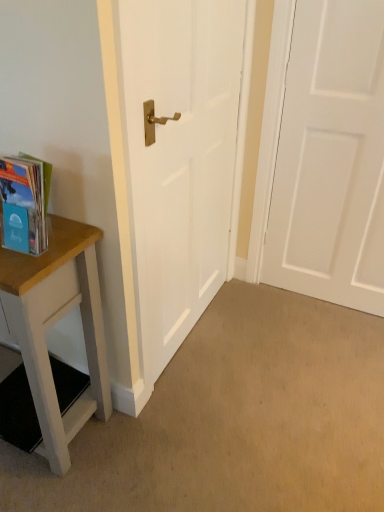
Locate an element on the screen. This screenshot has width=384, height=512. white matte door at center, which is the 1th door in left-to-right order is located at coordinates (178, 158).

Describe the element at coordinates (178, 158) in the screenshot. The image size is (384, 512). I see `white matte door at center, which is the 1th door in left-to-right order` at that location.

Describe the element at coordinates (24, 204) in the screenshot. The width and height of the screenshot is (384, 512). I see `translucent plastic book at left` at that location.

Locate an element on the screen. This screenshot has height=512, width=384. wooden table at left is located at coordinates (55, 323).

Identify the location of the 1st door positioned above the wooden table at left (from the image's perspective). (178, 158).

From the image's perspective, would you say white matte door at center, which is the 1th door in left-to-right order, is positioned over wooden table at left?

Yes, from the image's perspective, white matte door at center, which is the 1th door in left-to-right order, is above wooden table at left.

Considering the relative positions of white matte door at center, which appears as the 2th door when viewed from the right, and wooden table at left in the image provided, is white matte door at center, which appears as the 2th door when viewed from the right, to the right of wooden table at left from the viewer's perspective?

Indeed, white matte door at center, which appears as the 2th door when viewed from the right, is positioned on the right side of wooden table at left.

Can we say white matte door at center, which is the 1th door in left-to-right order, lies outside wooden table at left?

That's correct, white matte door at center, which is the 1th door in left-to-right order, is outside of wooden table at left.

Considering the relative sizes of wooden table at left and translucent plastic book at left in the image provided, is wooden table at left thinner than translucent plastic book at left?

Incorrect, the width of wooden table at left is not less than that of translucent plastic book at left.

Consider the image. Does wooden table at left have a lesser height compared to translucent plastic book at left?

In fact, wooden table at left may be taller than translucent plastic book at left.

Is wooden table at left positioned beyond the bounds of translucent plastic book at left?

Yes, wooden table at left is located beyond the bounds of translucent plastic book at left.

Is wooden table at left facing towards white matte door at right, which is the 1th door from right to left?

No, wooden table at left is not facing towards white matte door at right, which is the 1th door from right to left.

Consider the image. From the image's perspective, which is above, wooden table at left or white matte door at right, which appears as the second door when viewed from the left?

From the image's view, white matte door at right, which appears as the second door when viewed from the left, is above.

Could you measure the distance between wooden table at left and white matte door at right, which is the 1th door from right to left?

1.14 meters.

Who is shorter, wooden table at left or white matte door at right, which is the 1th door from right to left?

wooden table at left.

Which is behind, point (325, 150) or point (136, 12)?

Point (325, 150)

Considering the sizes of objects white matte door at right, which appears as the second door when viewed from the left, and white matte door at center, which is the 1th door in left-to-right order, in the image provided, who is taller, white matte door at right, which appears as the second door when viewed from the left, or white matte door at center, which is the 1th door in left-to-right order,?

With more height is white matte door at right, which appears as the second door when viewed from the left.

From a real-world perspective, between white matte door at right, which is the 1th door from right to left, and white matte door at center, which is the 1th door in left-to-right order, who is vertically lower?

In real-world perspective, white matte door at right, which is the 1th door from right to left, is lower.

Consider the image. Would you say white matte door at right, which is the 1th door from right to left, is to the left or to the right of white matte door at center, which appears as the 2th door when viewed from the right, in the picture?

white matte door at right, which is the 1th door from right to left, is to the right of white matte door at center, which appears as the 2th door when viewed from the right.

Is the depth of white matte door at center, which appears as the 2th door when viewed from the right, less than that of translucent plastic book at left?

No.

Could you tell me if white matte door at center, which appears as the 2th door when viewed from the right, is turned towards translucent plastic book at left?

No, white matte door at center, which appears as the 2th door when viewed from the right, is not aimed at translucent plastic book at left.

Does white matte door at center, which is the 1th door in left-to-right order, have a smaller size compared to translucent plastic book at left?

No, white matte door at center, which is the 1th door in left-to-right order, is not smaller than translucent plastic book at left.

Locate an element on the screen. Image resolution: width=384 pixels, height=512 pixels. table that appears behind the translucent plastic book at left is located at coordinates (55, 323).

Is translucent plastic book at left far away from wooden table at left?

No, translucent plastic book at left is not far away from wooden table at left.

Considering the sizes of objects translucent plastic book at left and wooden table at left in the image provided, who is smaller, translucent plastic book at left or wooden table at left?

With smaller size is translucent plastic book at left.

Considering the sizes of objects white matte door at center, which is the 1th door in left-to-right order, and white matte door at right, which appears as the second door when viewed from the left, in the image provided, who is wider, white matte door at center, which is the 1th door in left-to-right order, or white matte door at right, which appears as the second door when viewed from the left,?

Wider between the two is white matte door at right, which appears as the second door when viewed from the left.

From a real-world perspective, between white matte door at center, which is the 1th door in left-to-right order, and white matte door at right, which appears as the second door when viewed from the left, who is vertically lower?

In real-world perspective, white matte door at right, which appears as the second door when viewed from the left, is lower.

Does white matte door at center, which is the 1th door in left-to-right order, have a lesser height compared to white matte door at right, which is the 1th door from right to left?

Indeed, white matte door at center, which is the 1th door in left-to-right order, has a lesser height compared to white matte door at right, which is the 1th door from right to left.

Could you tell me if white matte door at center, which appears as the 2th door when viewed from the right, is turned towards white matte door at right, which is the 1th door from right to left?

Yes, white matte door at center, which appears as the 2th door when viewed from the right, faces towards white matte door at right, which is the 1th door from right to left.

Where is `the 1st door above the wooden table at left (from the image's perspective)`? The height and width of the screenshot is (512, 384). the 1st door above the wooden table at left (from the image's perspective) is located at coordinates (178, 158).

The image size is (384, 512). I want to click on book on the right of the wooden table at left, so click(24, 204).

Based on their spatial positions, is white matte door at right, which appears as the second door when viewed from the left, or white matte door at center, which appears as the 2th door when viewed from the right, further from wooden table at left?

Based on the image, white matte door at right, which appears as the second door when viewed from the left, appears to be further to wooden table at left.

Looking at the image, which one is located closer to white matte door at center, which is the 1th door in left-to-right order, wooden table at left or white matte door at right, which is the 1th door from right to left?

Based on the image, wooden table at left appears to be nearer to white matte door at center, which is the 1th door in left-to-right order.

Looking at the image, which one is located further to wooden table at left, white matte door at right, which appears as the second door when viewed from the left, or translucent plastic book at left?

Among the two, white matte door at right, which appears as the second door when viewed from the left, is located further to wooden table at left.

Which object lies nearer to the anchor point white matte door at center, which is the 1th door in left-to-right order, translucent plastic book at left or white matte door at right, which appears as the second door when viewed from the left?

The object closer to white matte door at center, which is the 1th door in left-to-right order, is translucent plastic book at left.

Looking at the image, which one is located closer to white matte door at right, which appears as the second door when viewed from the left, translucent plastic book at left or wooden table at left?

wooden table at left lies closer to white matte door at right, which appears as the second door when viewed from the left, than the other object.

Looking at the image, which one is located further to white matte door at center, which appears as the 2th door when viewed from the right, white matte door at right, which appears as the second door when viewed from the left, or wooden table at left?

Based on the image, white matte door at right, which appears as the second door when viewed from the left, appears to be further to white matte door at center, which appears as the 2th door when viewed from the right.

Based on their spatial positions, is translucent plastic book at left or white matte door at center, which appears as the 2th door when viewed from the right, closer to wooden table at left?

Among the two, translucent plastic book at left is located nearer to wooden table at left.

Considering their positions, is white matte door at center, which appears as the 2th door when viewed from the right, positioned closer to white matte door at right, which appears as the second door when viewed from the left, than translucent plastic book at left?

white matte door at center, which appears as the 2th door when viewed from the right, lies closer to white matte door at right, which appears as the second door when viewed from the left, than the other object.

You are a GUI agent. You are given a task and a screenshot of the screen. Output one action in this format:
    pyautogui.click(x=<x>, y=<y>)
    Task: Click on the book between wooden table at left and white matte door at center, which appears as the 2th door when viewed from the right
    The image size is (384, 512).
    Given the screenshot: What is the action you would take?
    pyautogui.click(x=24, y=204)

The width and height of the screenshot is (384, 512). Identify the location of door between wooden table at left and white matte door at right, which is the 1th door from right to left. (178, 158).

At what (x,y) coordinates should I click in order to perform the action: click on book between wooden table at left and white matte door at right, which appears as the second door when viewed from the left, from left to right. Please return your answer as a coordinate pair (x, y). Looking at the image, I should click on (24, 204).

Identify the location of door between translucent plastic book at left and white matte door at right, which appears as the second door when viewed from the left, from left to right. (178, 158).